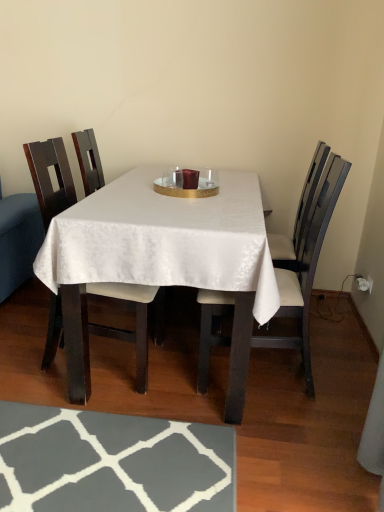
In order to click on vacant area located to the right-hand side of wooden chair at center, which is the 2th chair in left-to-right order in this screenshot , I will do pyautogui.click(x=337, y=371).